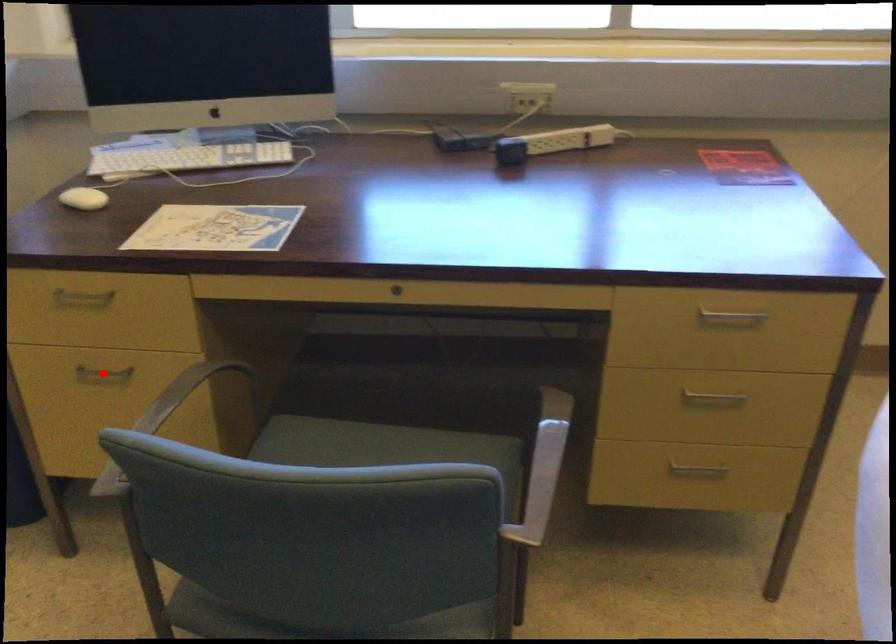
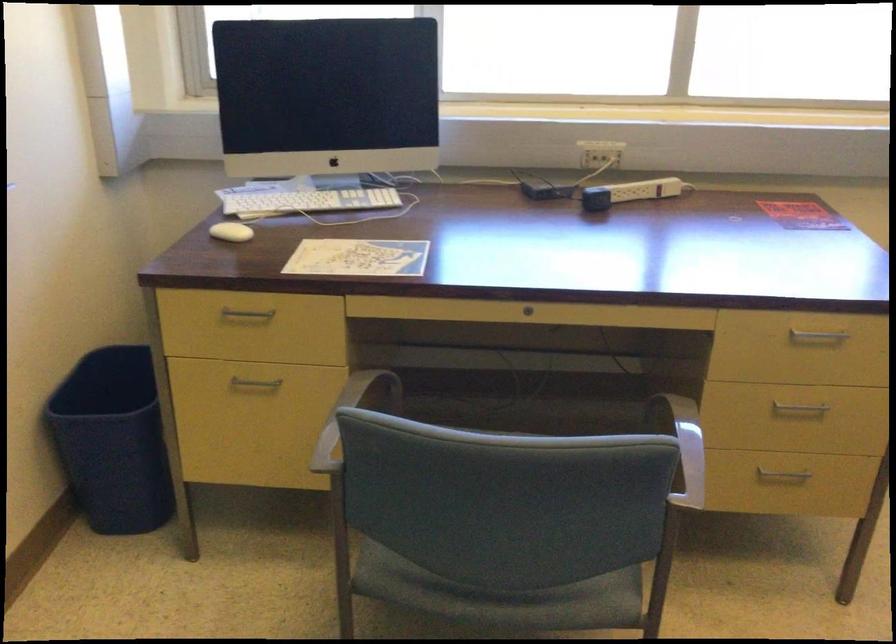
The point at the highlighted location is marked in the first image. Where is the corresponding point in the second image?

(254, 384)